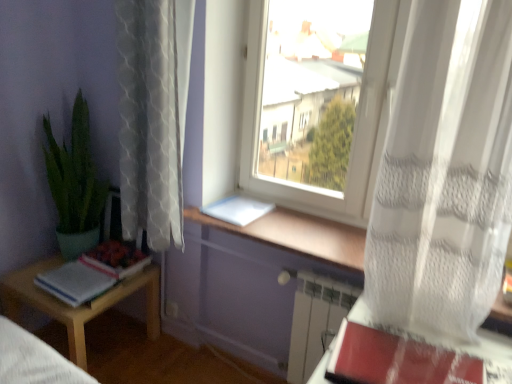
Locate an element on the screen. free space underneath white lace curtain at left, placed as the 2th curtain when sorted from right to left (from a real-world perspective) is located at coordinates (173, 374).